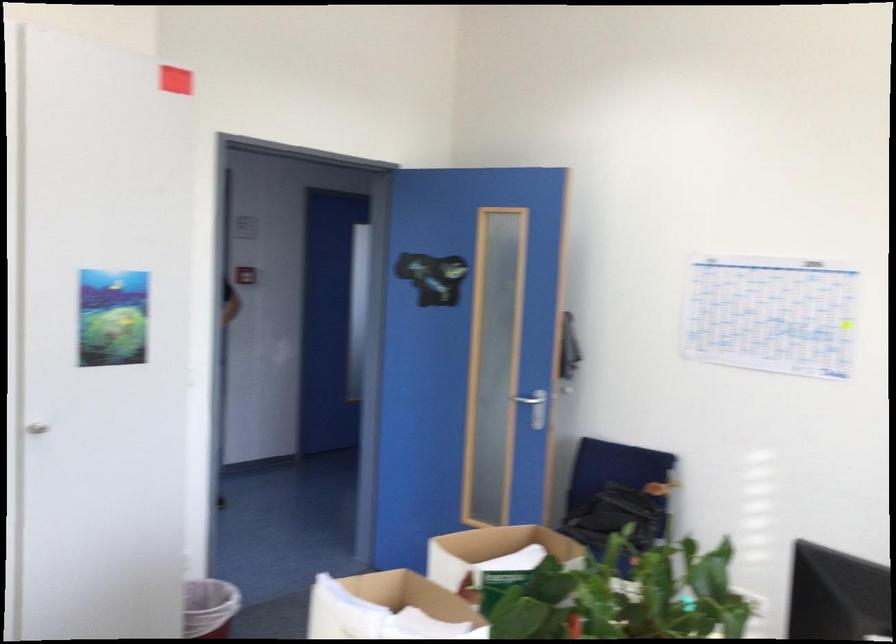
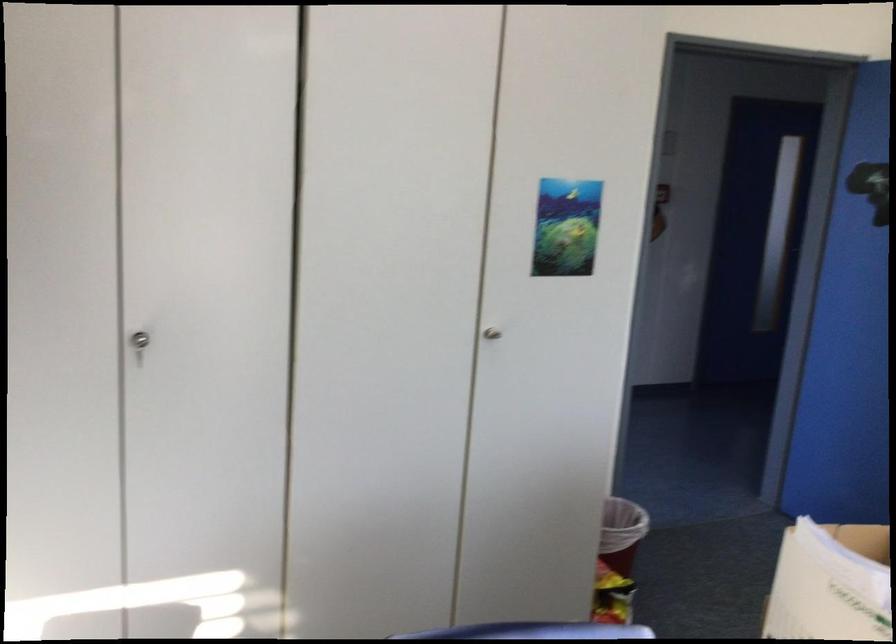
The images are taken continuously from a first-person perspective. In which direction are you moving?

The movement direction of the cameraman is left, forward.